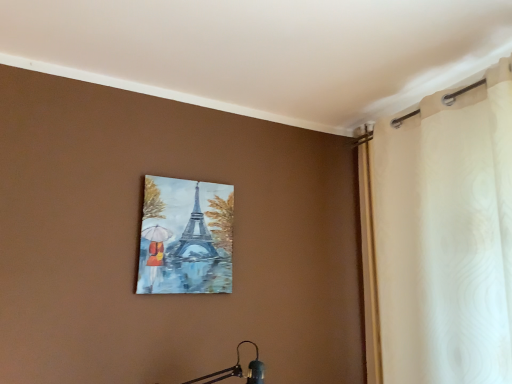
You are a GUI agent. You are given a task and a screenshot of the screen. Output one action in this format:
    pyautogui.click(x=<x>, y=<y>)
    Task: Click on the matte canvas painting of eiffel tower at upper center
    The image size is (512, 384).
    Given the screenshot: What is the action you would take?
    pyautogui.click(x=185, y=237)

This screenshot has width=512, height=384. What do you see at coordinates (185, 237) in the screenshot?
I see `matte canvas painting of eiffel tower at upper center` at bounding box center [185, 237].

Measure the distance between point (170, 229) and camera.

Point (170, 229) and camera are 2.02 meters apart.

In order to face white sheer curtain at upper right, should I rotate leftwards or rightwards?

To face it directly, rotate right by 24.917 degrees.

I want to click on white sheer curtain at upper right, so click(x=440, y=238).

Describe the element at coordinates (440, 238) in the screenshot. The image size is (512, 384). I see `white sheer curtain at upper right` at that location.

The image size is (512, 384). Find the location of `matte canvas painting of eiffel tower at upper center`. matte canvas painting of eiffel tower at upper center is located at coordinates (185, 237).

Which object is positioned more to the left, white sheer curtain at upper right or matte canvas painting of eiffel tower at upper center?

matte canvas painting of eiffel tower at upper center.

Which object is more forward, white sheer curtain at upper right or matte canvas painting of eiffel tower at upper center?

white sheer curtain at upper right.

Is point (443, 212) positioned behind point (161, 280)?

No, it is in front of (161, 280).

From the image's perspective, is white sheer curtain at upper right positioned above or below matte canvas painting of eiffel tower at upper center?

white sheer curtain at upper right is situated higher than matte canvas painting of eiffel tower at upper center in the image.

From a real-world perspective, which is physically above, white sheer curtain at upper right or matte canvas painting of eiffel tower at upper center?

matte canvas painting of eiffel tower at upper center, from a real-world perspective.

Which of these two, white sheer curtain at upper right or matte canvas painting of eiffel tower at upper center, is wider?

white sheer curtain at upper right.

Does white sheer curtain at upper right have a lesser height compared to matte canvas painting of eiffel tower at upper center?

Incorrect, the height of white sheer curtain at upper right does not fall short of that of matte canvas painting of eiffel tower at upper center.

In terms of size, does white sheer curtain at upper right appear bigger or smaller than matte canvas painting of eiffel tower at upper center?

Considering their sizes, white sheer curtain at upper right takes up more space than matte canvas painting of eiffel tower at upper center.

Is matte canvas painting of eiffel tower at upper center inside white sheer curtain at upper right?

Definitely not — matte canvas painting of eiffel tower at upper center is not inside white sheer curtain at upper right.

From the picture: Is white sheer curtain at upper right positioned far away from matte canvas painting of eiffel tower at upper center?

No, white sheer curtain at upper right is not far away from matte canvas painting of eiffel tower at upper center.

Could you tell me if white sheer curtain at upper right is facing matte canvas painting of eiffel tower at upper center?

No, white sheer curtain at upper right is not turned towards matte canvas painting of eiffel tower at upper center.

How different are the orientations of white sheer curtain at upper right and matte canvas painting of eiffel tower at upper center in degrees?

89.1 degrees separate the facing orientations of white sheer curtain at upper right and matte canvas painting of eiffel tower at upper center.

Locate an element on the screen. This screenshot has width=512, height=384. picture frame above the white sheer curtain at upper right (from a real-world perspective) is located at coordinates (x=185, y=237).

Does matte canvas painting of eiffel tower at upper center appear on the left side of white sheer curtain at upper right?

Indeed, matte canvas painting of eiffel tower at upper center is positioned on the left side of white sheer curtain at upper right.

In the scene shown: Considering the positions of objects matte canvas painting of eiffel tower at upper center and white sheer curtain at upper right in the image provided, who is behind, matte canvas painting of eiffel tower at upper center or white sheer curtain at upper right?

matte canvas painting of eiffel tower at upper center.

Is point (167, 287) positioned after point (424, 185)?

Yes.

From the image's perspective, which is below, matte canvas painting of eiffel tower at upper center or white sheer curtain at upper right?

matte canvas painting of eiffel tower at upper center is shown below in the image.

From a real-world perspective, is matte canvas painting of eiffel tower at upper center under white sheer curtain at upper right?

Actually, matte canvas painting of eiffel tower at upper center is physically above white sheer curtain at upper right in the real world.

Can you confirm if matte canvas painting of eiffel tower at upper center is wider than white sheer curtain at upper right?

In fact, matte canvas painting of eiffel tower at upper center might be narrower than white sheer curtain at upper right.

Considering the relative sizes of matte canvas painting of eiffel tower at upper center and white sheer curtain at upper right in the image provided, is matte canvas painting of eiffel tower at upper center taller than white sheer curtain at upper right?

A: In fact, matte canvas painting of eiffel tower at upper center may be shorter than white sheer curtain at upper right.

Can you confirm if matte canvas painting of eiffel tower at upper center is smaller than white sheer curtain at upper right?

Yes.

Would you say matte canvas painting of eiffel tower at upper center is inside or outside white sheer curtain at upper right?

matte canvas painting of eiffel tower at upper center is located beyond the bounds of white sheer curtain at upper right.

In the scene shown: Is matte canvas painting of eiffel tower at upper center placed right next to white sheer curtain at upper right?

matte canvas painting of eiffel tower at upper center is not next to white sheer curtain at upper right, and they're not touching.

In the scene shown: Is matte canvas painting of eiffel tower at upper center oriented away from white sheer curtain at upper right?

matte canvas painting of eiffel tower at upper center is not turned away from white sheer curtain at upper right.

What's the angular difference between matte canvas painting of eiffel tower at upper center and white sheer curtain at upper right's facing directions?

The angular difference between matte canvas painting of eiffel tower at upper center and white sheer curtain at upper right is 89.1 degrees.

What are the coordinates of `curtain in front of the matte canvas painting of eiffel tower at upper center` in the screenshot? It's located at (440, 238).

I want to click on picture frame behind the white sheer curtain at upper right, so click(185, 237).

Locate an element on the screen. The image size is (512, 384). curtain below the matte canvas painting of eiffel tower at upper center (from a real-world perspective) is located at coordinates (440, 238).